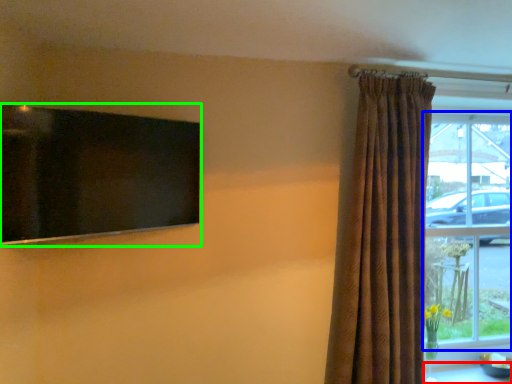
Question: Which object is the closest to the table (highlighted by a red box)? Choose among these: window (highlighted by a blue box) or window screen (highlighted by a green box).

Choices:
 (A) window
 (B) window screen

Answer: (A)